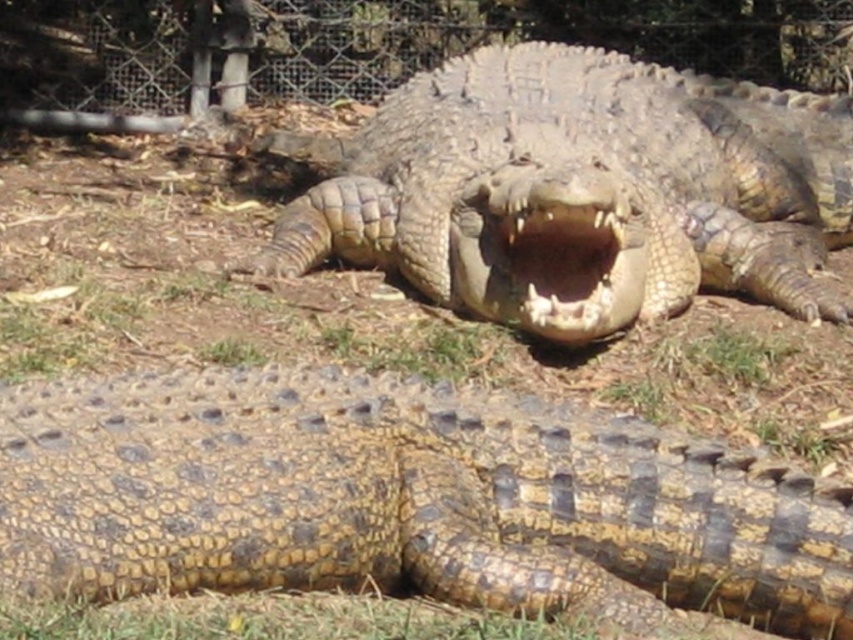
You are a wildlife photographer aiming to capture a closeup of the crocodile at point (584,192). Based on the scene description, which crocodile should you focus on?

The leathery brown crocodile at center is located at point (584,192). You should focus on the leathery brown crocodile at center.